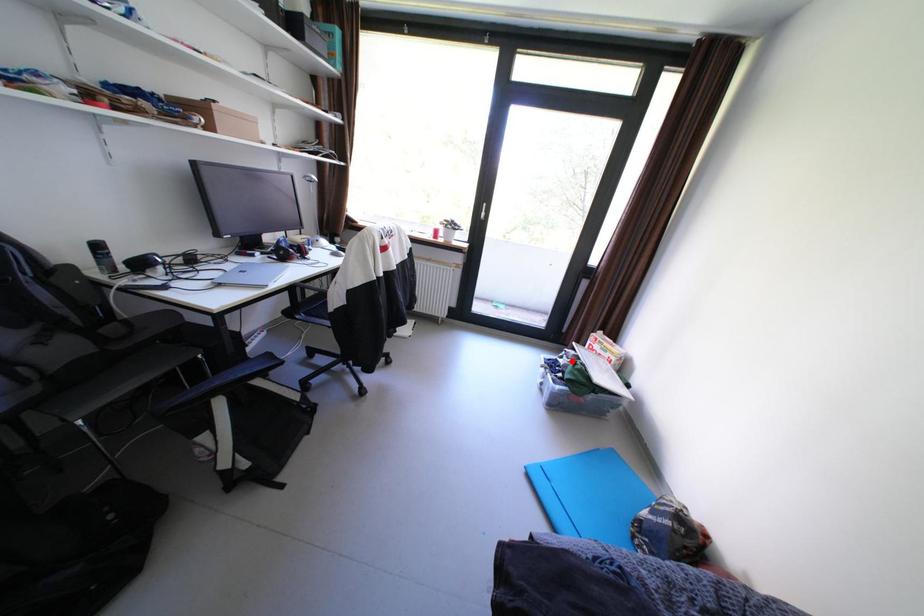
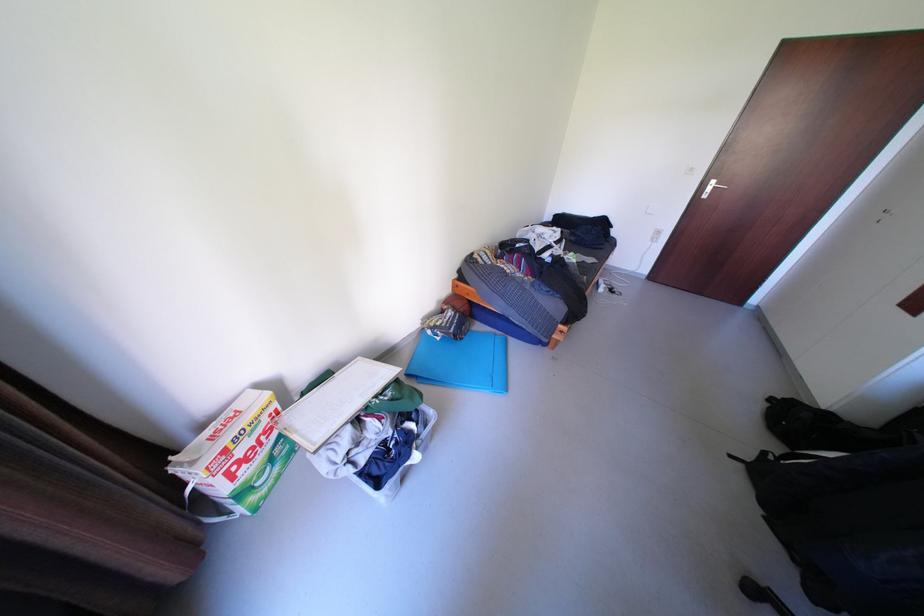
Find the pixel in the second image that matches the highlighted location in the first image.

(372, 459)